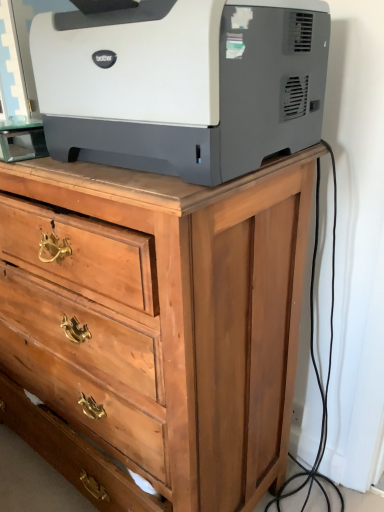
Question: Is wooden chest of drawers at upper center taller than white matte printer at upper center?

Choices:
 (A) no
 (B) yes

Answer: (B)

Question: Is wooden chest of drawers at upper center facing towards white matte printer at upper center?

Choices:
 (A) no
 (B) yes

Answer: (A)

Question: Can we say wooden chest of drawers at upper center lies outside white matte printer at upper center?

Choices:
 (A) no
 (B) yes

Answer: (B)

Question: Considering the relative sizes of wooden chest of drawers at upper center and white matte printer at upper center in the image provided, is wooden chest of drawers at upper center smaller than white matte printer at upper center?

Choices:
 (A) no
 (B) yes

Answer: (A)

Question: Is white matte printer at upper center located within wooden chest of drawers at upper center?

Choices:
 (A) yes
 (B) no

Answer: (B)

Question: Does wooden chest of drawers at upper center lie behind white matte printer at upper center?

Choices:
 (A) yes
 (B) no

Answer: (A)

Question: From a real-world perspective, is white matte printer at upper center positioned over wooden chest of drawers at upper center based on gravity?

Choices:
 (A) yes
 (B) no

Answer: (A)

Question: Is white matte printer at upper center in front of wooden chest of drawers at upper center?

Choices:
 (A) yes
 (B) no

Answer: (A)

Question: Is white matte printer at upper center facing away from wooden chest of drawers at upper center?

Choices:
 (A) no
 (B) yes

Answer: (A)

Question: Does white matte printer at upper center turn towards wooden chest of drawers at upper center?

Choices:
 (A) no
 (B) yes

Answer: (A)

Question: Is white matte printer at upper center thinner than wooden chest of drawers at upper center?

Choices:
 (A) yes
 (B) no

Answer: (A)

Question: Can you see white matte printer at upper center touching wooden chest of drawers at upper center?

Choices:
 (A) no
 (B) yes

Answer: (A)

Question: Is point (105, 51) positioned closer to the camera than point (71, 326)?

Choices:
 (A) closer
 (B) farther

Answer: (A)